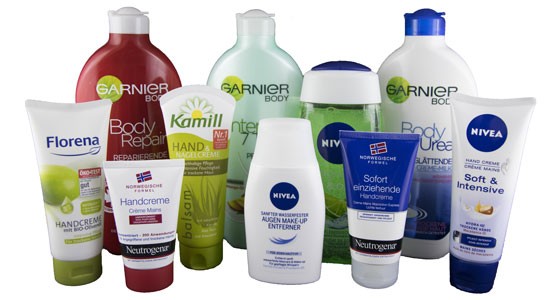
Identify the location of bottle. (140, 81), (252, 68), (332, 102), (421, 65).